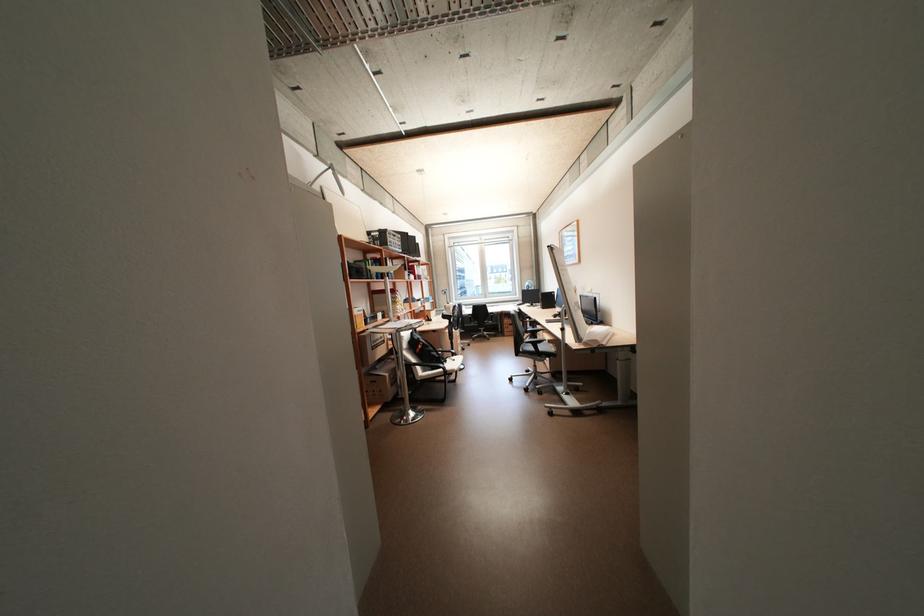
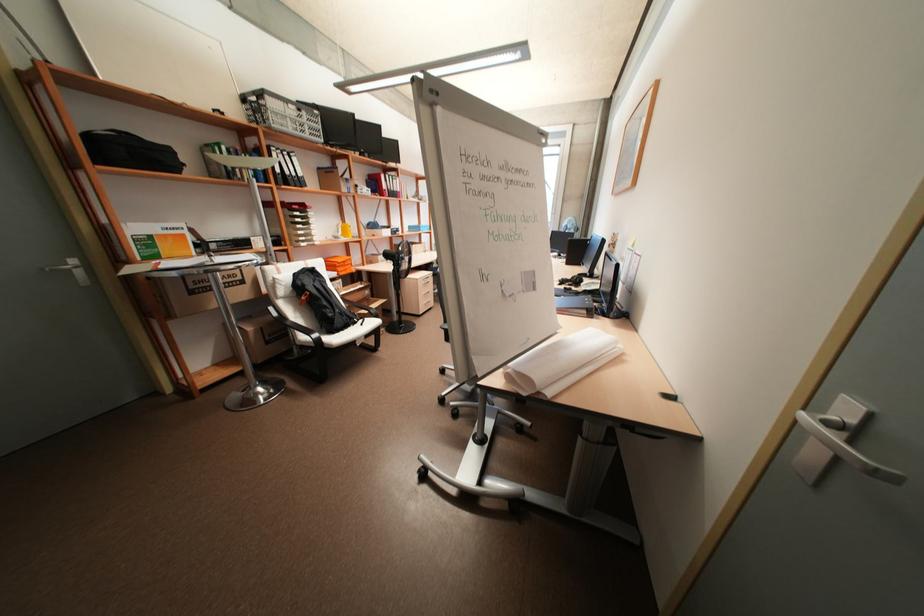
Which direction would the cameraman need to move to produce the second image?

The movement direction of the cameraman is right, forward.